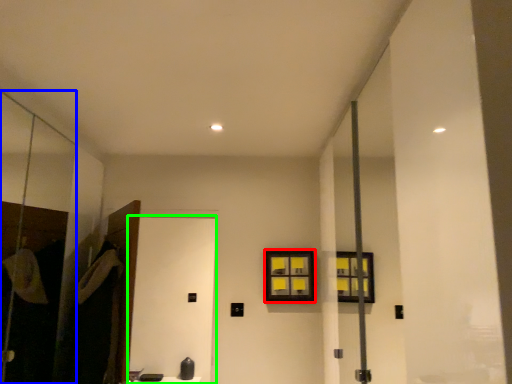
Question: Considering the real-world distances, which object is farthest from window (highlighted by a red box)? screen door (highlighted by a blue box) or screen door (highlighted by a green box)?

Choices:
 (A) screen door
 (B) screen door

Answer: (B)